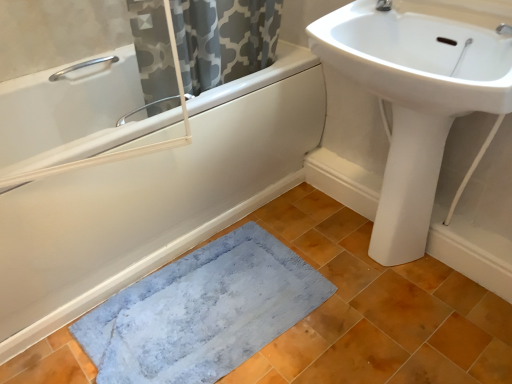
Question: In the image, is white matte bathtub at lower left positioned in front of or behind white glossy sink at upper right?

Choices:
 (A) front
 (B) behind

Answer: (B)

Question: From the image's perspective, is white matte bathtub at lower left above or below white glossy sink at upper right?

Choices:
 (A) below
 (B) above

Answer: (A)

Question: Which is farther from the silver metallic grab bar at upper left?

Choices:
 (A) blue soft rug at lower left
 (B) white glossy sink at upper right
 (C) white matte bathtub at lower left
 (D) white glossy bidet at lower right

Answer: (D)

Question: Estimate the real-world distances between objects in this image. Which object is closer to the white glossy bidet at lower right?

Choices:
 (A) blue soft rug at lower left
 (B) white matte bathtub at lower left
 (C) silver metallic grab bar at upper left
 (D) white glossy sink at upper right

Answer: (D)